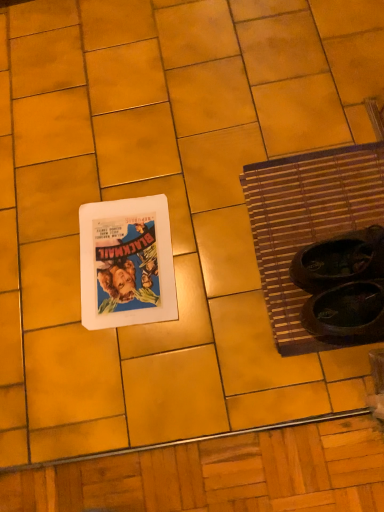
You are a GUI agent. You are given a task and a screenshot of the screen. Output one action in this format:
    pyautogui.click(x=<x>, y=<y>)
    Task: Click on the brown woven mat at right
    
    Given the screenshot: What is the action you would take?
    pyautogui.click(x=307, y=221)

This screenshot has width=384, height=512. What do you see at coordinates (307, 221) in the screenshot? I see `brown woven mat at right` at bounding box center [307, 221].

In order to face brown woven mat at right, should I rotate leftwards or rightwards?

You should look right and rotate roughly 18.866 degrees.

Where is `white matte picture frame at center-left`? The height and width of the screenshot is (512, 384). white matte picture frame at center-left is located at coordinates (126, 263).

This screenshot has width=384, height=512. What do you see at coordinates (126, 263) in the screenshot?
I see `white matte picture frame at center-left` at bounding box center [126, 263].

This screenshot has width=384, height=512. I want to click on brown woven mat at right, so pyautogui.click(x=307, y=221).

Between brown woven mat at right and white matte picture frame at center-left, which one appears on the right side from the viewer's perspective?

Positioned to the right is brown woven mat at right.

Does brown woven mat at right lie behind white matte picture frame at center-left?

No.

Does point (287, 346) come behind point (86, 220)?

No, (287, 346) is closer to viewer.

From the image's perspective, which object appears higher, brown woven mat at right or white matte picture frame at center-left?

brown woven mat at right is shown above in the image.

From a real-world perspective, who is located higher, brown woven mat at right or white matte picture frame at center-left?

In real-world perspective, white matte picture frame at center-left is above.

Is brown woven mat at right thinner than white matte picture frame at center-left?

No.

Between brown woven mat at right and white matte picture frame at center-left, which one has less height?

With less height is white matte picture frame at center-left.

Can you confirm if brown woven mat at right is bigger than white matte picture frame at center-left?

Indeed, brown woven mat at right has a larger size compared to white matte picture frame at center-left.

Is white matte picture frame at center-left inside brown woven mat at right?

No, brown woven mat at right does not contain white matte picture frame at center-left.

Is brown woven mat at right not close to white matte picture frame at center-left?

They are positioned close to each other.

Is brown woven mat at right facing away from white matte picture frame at center-left?

No, brown woven mat at right is not facing away from white matte picture frame at center-left.

How far apart are brown woven mat at right and white matte picture frame at center-left?

brown woven mat at right is 11.86 inches away from white matte picture frame at center-left.

Locate an element on the screen. The height and width of the screenshot is (512, 384). bath mat that is under the white matte picture frame at center-left (from a real-world perspective) is located at coordinates (307, 221).

Does white matte picture frame at center-left appear on the left side of brown woven mat at right?

Indeed, white matte picture frame at center-left is positioned on the left side of brown woven mat at right.

Who is more distant, white matte picture frame at center-left or brown woven mat at right?

white matte picture frame at center-left is more distant.

Which is in front, point (98, 296) or point (323, 173)?

The point (98, 296) is closer to the camera.

From the picture: From the image's perspective, which is below, white matte picture frame at center-left or brown woven mat at right?

white matte picture frame at center-left is shown below in the image.

From a real-world perspective, between white matte picture frame at center-left and brown woven mat at right, who is vertically higher?

white matte picture frame at center-left, from a real-world perspective.

Which of these two, white matte picture frame at center-left or brown woven mat at right, is thinner?

With smaller width is white matte picture frame at center-left.

Who is taller, white matte picture frame at center-left or brown woven mat at right?

With more height is brown woven mat at right.

In the scene shown: Which of these two, white matte picture frame at center-left or brown woven mat at right, is bigger?

With larger size is brown woven mat at right.

Could brown woven mat at right be considered to be inside white matte picture frame at center-left?

No.

Are white matte picture frame at center-left and brown woven mat at right located far from each other?

They are positioned close to each other.

Based on the photo, does white matte picture frame at center-left turn towards brown woven mat at right?

No, white matte picture frame at center-left is not facing towards brown woven mat at right.

This screenshot has height=512, width=384. In the image, there is a white matte picture frame at center-left. Find the location of `bath mat above it (from the image's perspective)`. bath mat above it (from the image's perspective) is located at coordinates (307, 221).

Find the location of a particular element. picture frame below the brown woven mat at right (from the image's perspective) is located at coordinates tap(126, 263).

Locate an element on the screen. bath mat in front of the white matte picture frame at center-left is located at coordinates (307, 221).